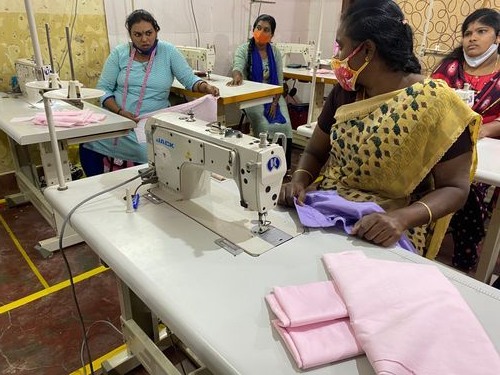
Image resolution: width=500 pixels, height=375 pixels. Identify the location of pink fabric. (426, 322), (330, 304), (315, 352), (80, 113), (209, 102).